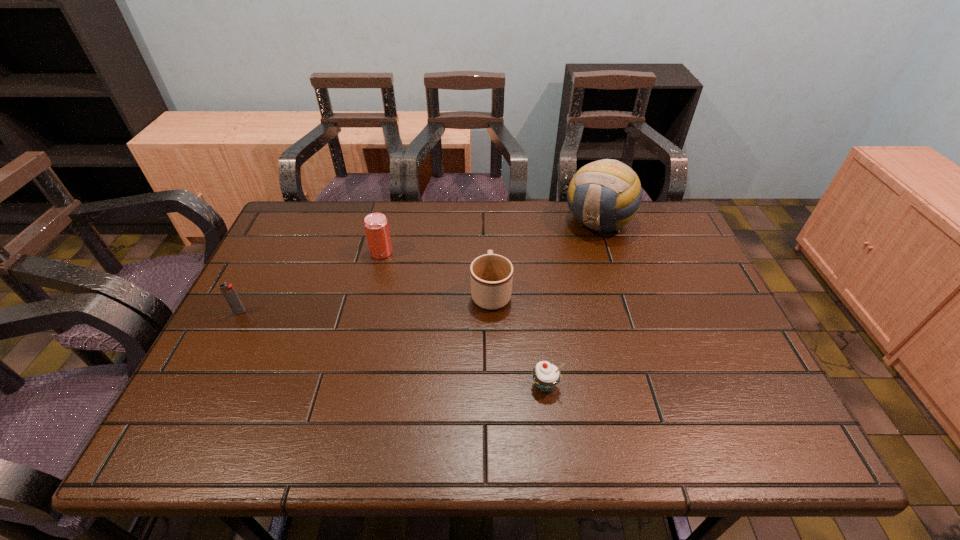
Where is `free space between the second object from left to right and the tallest object`? The width and height of the screenshot is (960, 540). free space between the second object from left to right and the tallest object is located at coordinates (490, 237).

You are a GUI agent. You are given a task and a screenshot of the screen. Output one action in this format:
    pyautogui.click(x=<x>, y=<y>)
    Task: Click on the free spot between the farthest object and the leftmost object
    This screenshot has width=960, height=540.
    Given the screenshot: What is the action you would take?
    pyautogui.click(x=420, y=267)

Where is `free space between the second farthest object and the farthest object`? This screenshot has width=960, height=540. free space between the second farthest object and the farthest object is located at coordinates (490, 237).

At what (x,y) coordinates should I click in order to perform the action: click on free space between the beer can and the nearest object. Please return your answer as a coordinate pair (x, y). This screenshot has height=540, width=960. Looking at the image, I should click on (464, 319).

Identify the location of vacant region between the third object from left to right and the cupcake. The height and width of the screenshot is (540, 960). (517, 339).

The width and height of the screenshot is (960, 540). I want to click on empty space between the second object from left to right and the mug, so click(436, 272).

This screenshot has height=540, width=960. Find the location of `free point between the leftmost object and the fourth nearest object`. free point between the leftmost object and the fourth nearest object is located at coordinates (311, 282).

The image size is (960, 540). I want to click on object that is the fourth closest one to the mug, so click(x=231, y=296).

At what (x,y) coordinates should I click in order to perform the action: click on the third closest object relative to the cupcake. Please return your answer as a coordinate pair (x, y). Looking at the image, I should click on (376, 226).

Identify the location of blank space that satisfies the following two spatial constraints: 1. on the back side of the tallest object; 2. on the right side of the beer can. (389, 221).